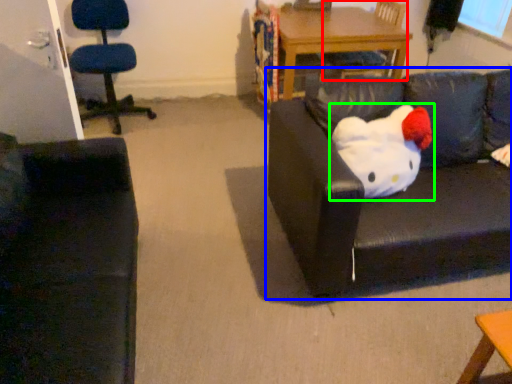
Question: Which object is the farthest from chair (highlighted by a red box)? Choose among these: studio couch (highlighted by a blue box) or toy (highlighted by a green box).

Choices:
 (A) studio couch
 (B) toy

Answer: (B)